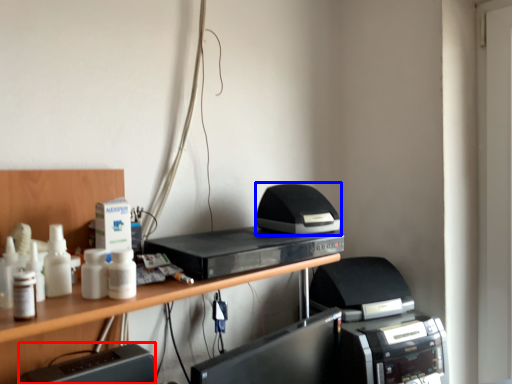
Question: Which object appears closest to the camera in this image, register (highlighted by a red box) or printer (highlighted by a blue box)?

Choices:
 (A) register
 (B) printer

Answer: (A)